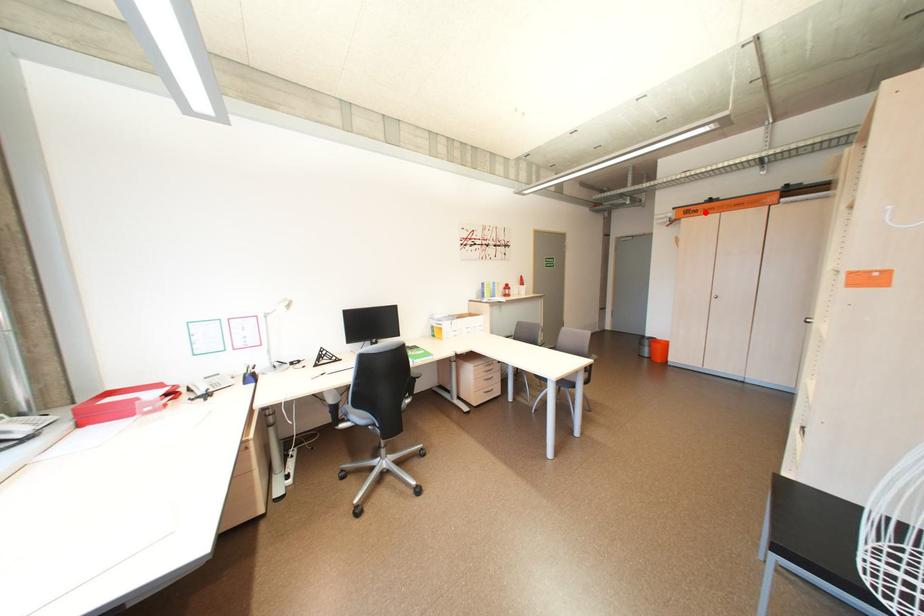
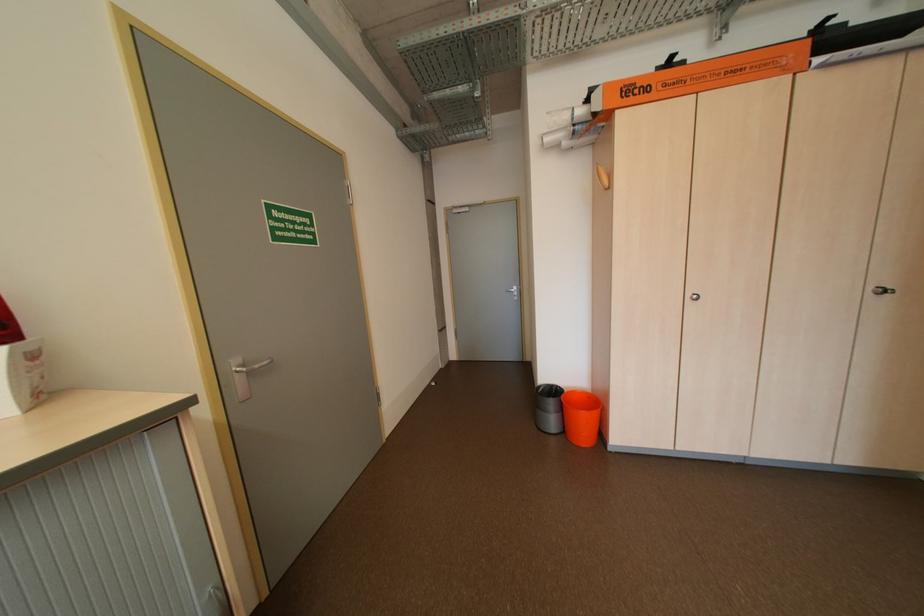
Question: I am providing you with two images of the same scene from different viewpoints. A red point is marked on the first image. At the location where the point appears in image 1, is it still visible in image 2?

Choices:
 (A) Yes
 (B) No

Answer: (A)